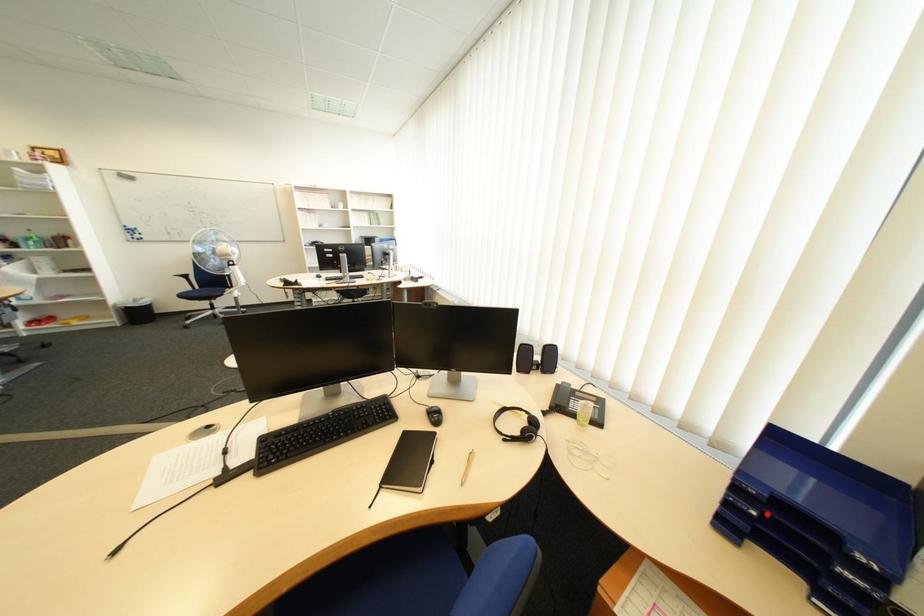
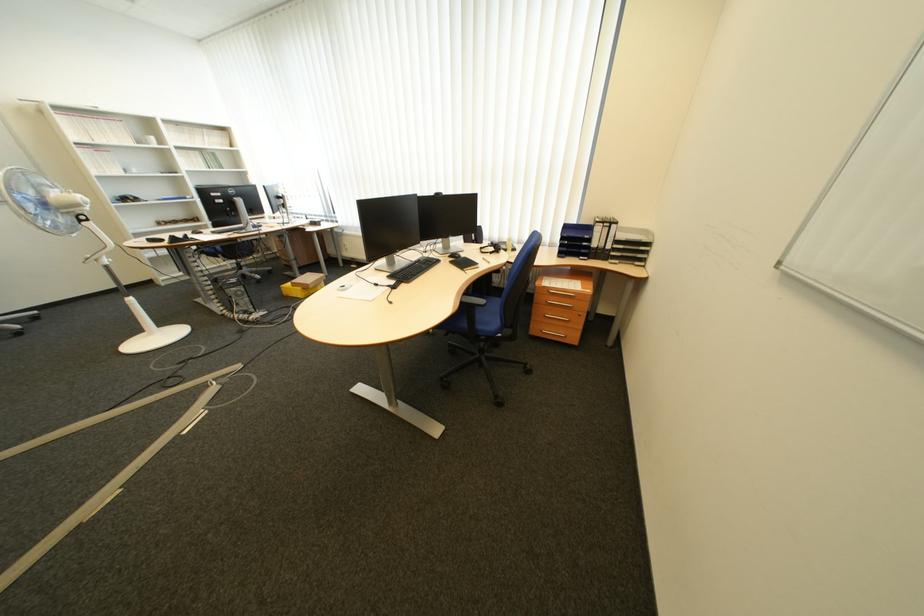
Question: A red point is marked in image1. In image2, is the corresponding 3D point closer to the camera or farther? Reply with the corresponding letter.

Choices:
 (A) The corresponding 3D point is closer.
 (B) The corresponding 3D point is farther.

Answer: (A)